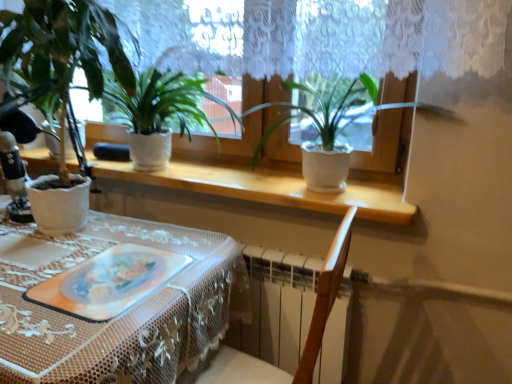
Identify the location of free space in front of translucent plastic platter at center. This screenshot has width=512, height=384. (72, 336).